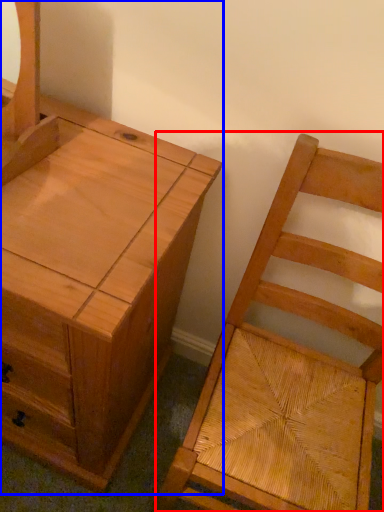
Question: Among these objects, which one is nearest to the camera, chair (highlighted by a red box) or chest of drawers (highlighted by a blue box)?

Choices:
 (A) chair
 (B) chest of drawers

Answer: (A)